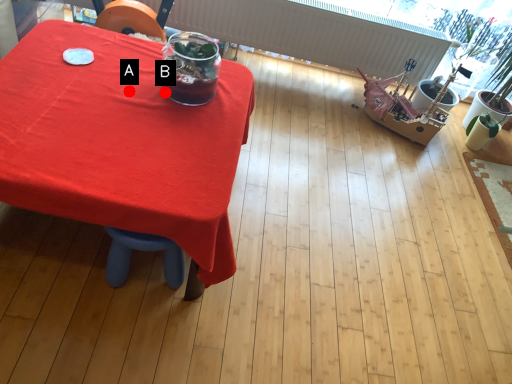
Question: Two points are circled on the image, labeled by A and B beside each circle. Which point is further to the camera?

Choices:
 (A) A is further
 (B) B is further

Answer: (B)